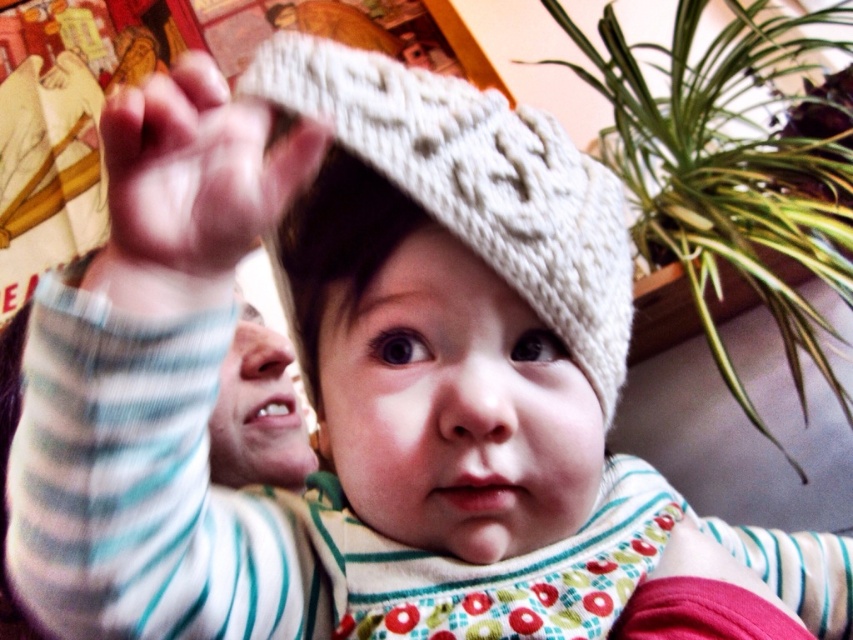
Question: Is green leafy plant at upper right to the right of white knitted hat at center from the viewer's perspective?

Choices:
 (A) no
 (B) yes

Answer: (B)

Question: Which of the following is the closest to the observer?

Choices:
 (A) (242, 173)
 (B) (804, 161)

Answer: (A)

Question: Which of the following is the closest to the observer?

Choices:
 (A) green leafy plant at upper right
 (B) white knitted hand at upper center
 (C) white knitted hat at center

Answer: (B)

Question: Observing the image, what is the correct spatial positioning of green leafy plant at upper right in reference to white knitted hat at center?

Choices:
 (A) left
 (B) right

Answer: (B)

Question: Which point is closer to the camera?

Choices:
 (A) (527, 108)
 (B) (738, 388)

Answer: (A)

Question: Can you confirm if white knitted hat at center is bigger than white knitted hand at upper center?

Choices:
 (A) no
 (B) yes

Answer: (B)